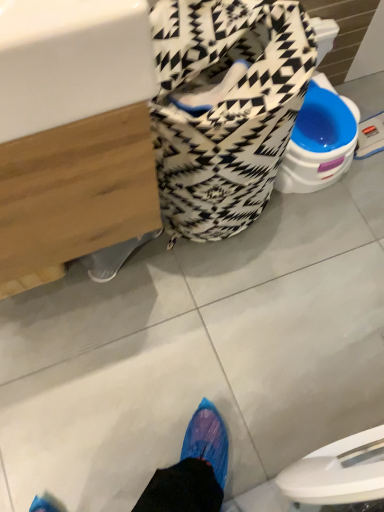
At what (x,y) coordinates should I click in order to perform the action: click on free spot to the right of white glossy sink at upper left. Please return your answer as a coordinate pair (x, y). Looking at the image, I should click on (209, 306).